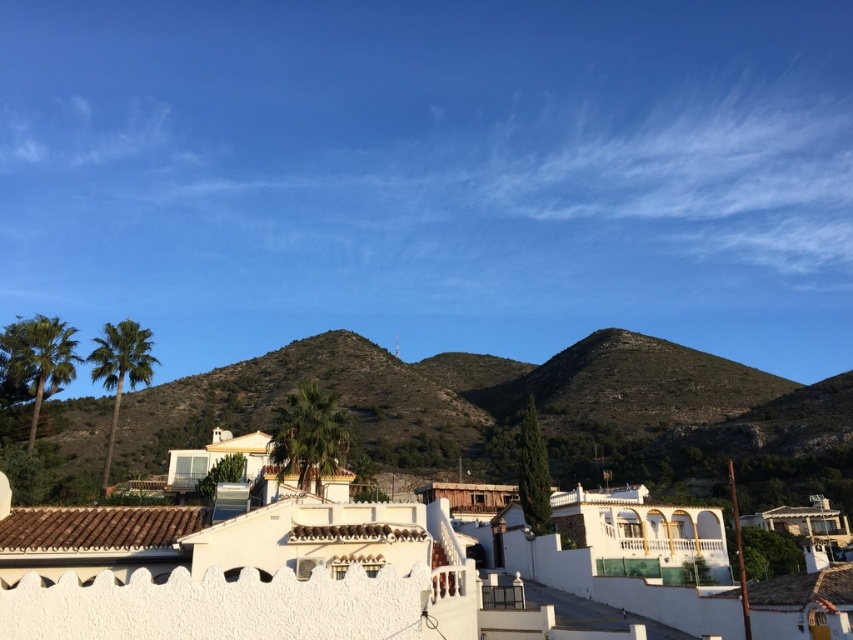
You are standing in the Mediterranean residential area and want to take a photo of both point (357,420) and point (299,460). Since you can only focus on one point at a time, which point should you focus on to ensure the other is still in the background?

You should focus on point (299,460) because it is closer to the camera, allowing point (357,420) to remain in the background.

You are a landscape architect planning to install a new water feature between the green textured hillside at center and the green leafy palm tree at center. Considering their heights, which one should the water feature be placed closer to for optimal visibility?

The water feature should be placed closer to the green leafy palm tree at center because the green textured hillside at center is taller and might obstruct the view of the water feature if placed too close to it.

You are standing in the Mediterranean residential area and want to take a photo of the green textured hillside at center and the green leafy palm at left. Which object should you focus on first to ensure both are in the frame?

You should focus on the green textured hillside at center first because it is closer to you than the green leafy palm at left, so adjusting the camera to include both would require starting with the closer object.